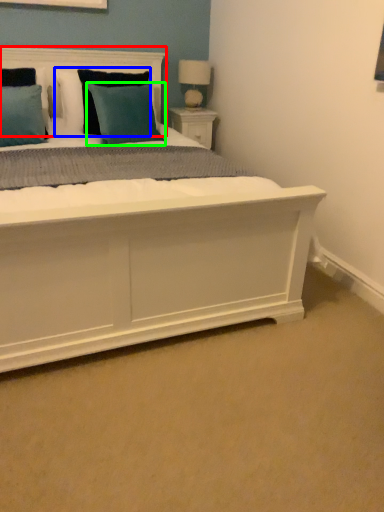
Question: Which object is positioned closest to headboard (highlighted by a red box)? Select from pillow (highlighted by a blue box) and pillow (highlighted by a green box).

Choices:
 (A) pillow
 (B) pillow

Answer: (A)